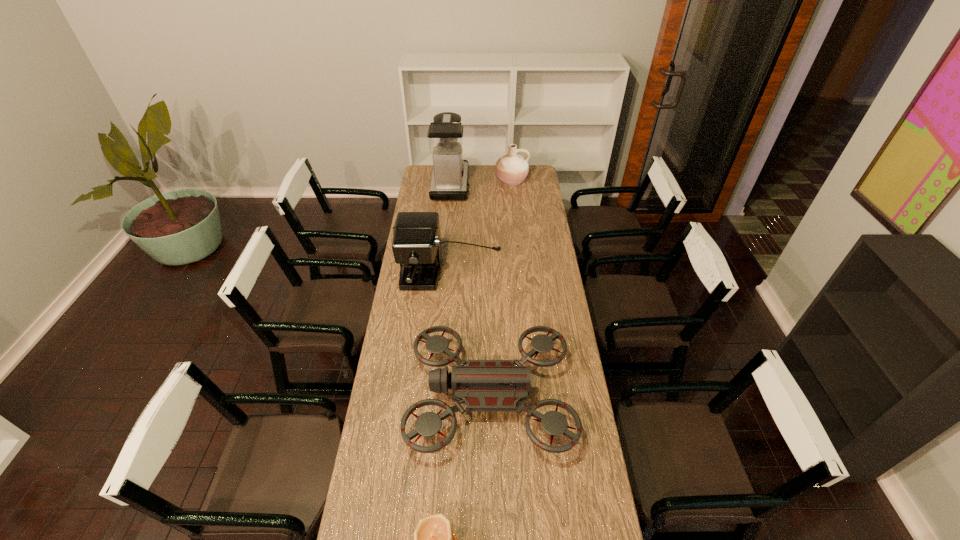
Locate an element on the screen. This screenshot has width=960, height=540. vacant position in the image that satisfies the following two spatial constraints: 1. to pour from the handle of the third shortest object; 2. on the front-facing side of the drone is located at coordinates (532, 397).

The image size is (960, 540). In order to click on free space that satisfies the following two spatial constraints: 1. to pour from the handle of the pottery; 2. at the front of the tallest object where the controls are located in this screenshot , I will do `click(512, 185)`.